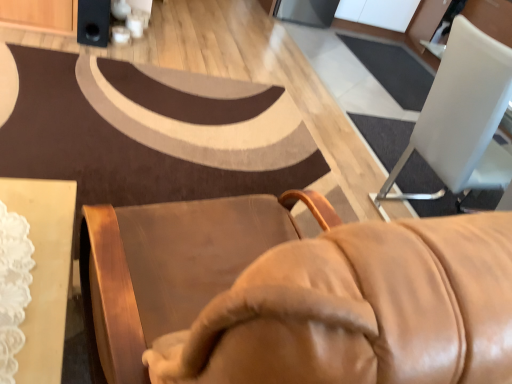
Locate an element on the screen. vacant area that is situated to the right of black matte speaker at upper left is located at coordinates (138, 45).